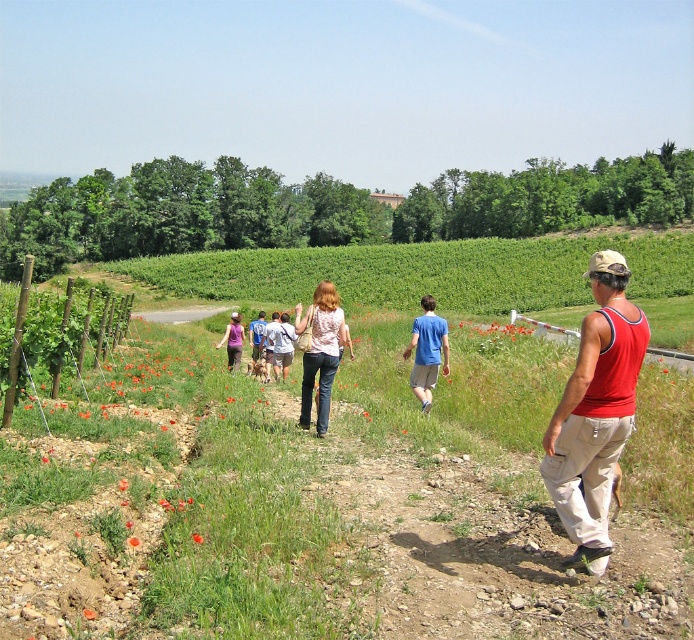
Is point (321, 420) closer to viewer compared to point (262, 312)?

Yes, point (321, 420) is closer to viewer.

Between point (323, 340) and point (251, 346), which one is positioned in front?

Point (323, 340)

This screenshot has height=640, width=694. Identify the location of matte pink shirt at center. (321, 349).

Where is `matte pink shirt at center`? matte pink shirt at center is located at coordinates (321, 349).

Does red sleeveless tank top at right appear on the left side of denim shorts at center?

Incorrect, red sleeveless tank top at right is not on the left side of denim shorts at center.

This screenshot has height=640, width=694. What do you see at coordinates (595, 412) in the screenshot?
I see `red sleeveless tank top at right` at bounding box center [595, 412].

Is point (577, 413) positioned behind point (251, 330)?

No.

Find the location of a particular element. red sleeveless tank top at right is located at coordinates (595, 412).

Does red sleeveless tank top at right appear on the left side of matte pink shirt at center?

No, red sleeveless tank top at right is not to the left of matte pink shirt at center.

Does red sleeveless tank top at right appear on the right side of matte pink shirt at center?

Indeed, red sleeveless tank top at right is positioned on the right side of matte pink shirt at center.

Between point (568, 396) and point (337, 298), which one is positioned behind?

Point (337, 298)

Where is `red sleeveless tank top at right`? red sleeveless tank top at right is located at coordinates (595, 412).